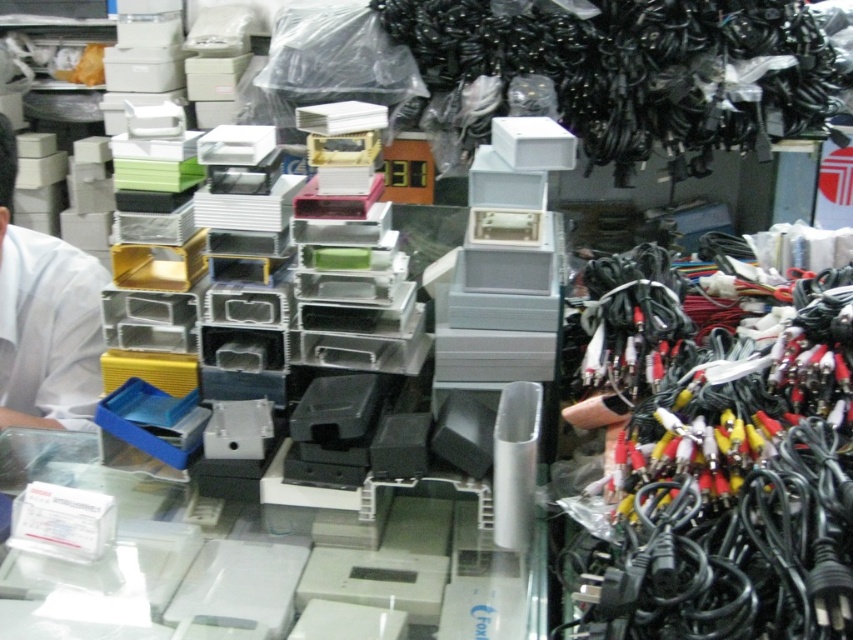
You are standing in the cluttered workspace and want to reach both points. Which point, point (613, 515) or point (634, 83), is closer to you?

Point (613, 515) is closer to you than point (634, 83).

You are a technician standing in front of the workspace. You need to reach the black rubber cables at upper right to connect a device. Considering your arm length is 0.7 meters, can you comfortably reach them without moving any items?

The black rubber cables at upper right are 2.22 meters away from you. Since your arm length is only 0.7 meters, you cannot comfortably reach them without moving any items.

You are organizing the workspace and need to place the black rubber cables at upper right and the white matte shirt at left into a drawer. The drawer has a width of 20 cm. Which item will not fit if placed individually?

The black rubber cables at upper right are wider than the white matte shirt at left. Since the drawer is 20 cm wide, the black rubber cables at upper right may not fit individually if their width exceeds 20 cm, while the white matte shirt at left might fit as it is narrower.